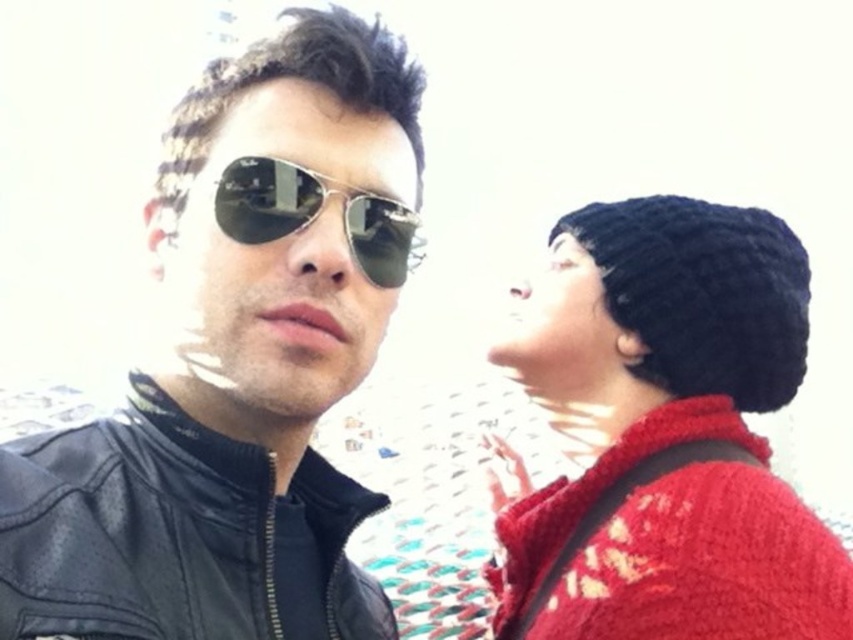
Question: Among these objects, which one is farthest from the camera?

Choices:
 (A) knitted black beanie at upper right
 (B) metallic aviator sunglasses at center
 (C) black leather jacket at left
 (D) leather jacket at center

Answer: (A)

Question: Where is knitted black beanie at upper right located in relation to metallic aviator sunglasses at center in the image?

Choices:
 (A) above
 (B) below

Answer: (B)

Question: Which point is farther to the camera?

Choices:
 (A) black leather jacket at left
 (B) metallic aviator sunglasses at center
 (C) knitted black beanie at upper right
 (D) leather jacket at center

Answer: (C)

Question: Which of these objects is positioned closest to the leather jacket at center?

Choices:
 (A) metallic aviator sunglasses at center
 (B) knitted black beanie at upper right

Answer: (A)

Question: Can you confirm if knitted black beanie at upper right is smaller than metallic aviator sunglasses at center?

Choices:
 (A) yes
 (B) no

Answer: (B)

Question: Observing the image, what is the correct spatial positioning of knitted black beanie at upper right in reference to black leather jacket at left?

Choices:
 (A) left
 (B) right

Answer: (B)